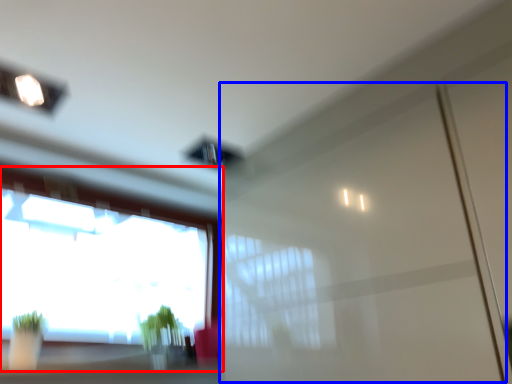
Question: Which point is closer to the camera, window (highlighted by a red box) or screen door (highlighted by a blue box)?

Choices:
 (A) window
 (B) screen door

Answer: (B)